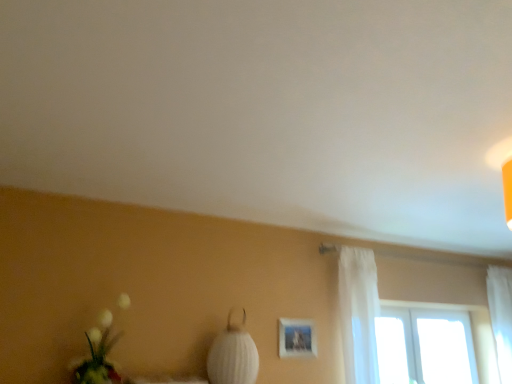
Question: From a real-world perspective, is white fabric lampshade at center on top of white sheer curtain at right, which is the second curtain from left to right?

Choices:
 (A) no
 (B) yes

Answer: (A)

Question: Is white fabric lampshade at center directly adjacent to white sheer curtain at right, the first curtain when ordered from right to left?

Choices:
 (A) yes
 (B) no

Answer: (B)

Question: Is white fabric lampshade at center turned away from white sheer curtain at right, which is the second curtain from left to right?

Choices:
 (A) no
 (B) yes

Answer: (A)

Question: From the image's perspective, is white fabric lampshade at center located above white sheer curtain at right, marked as the 1th curtain in a back-to-front arrangement?

Choices:
 (A) yes
 (B) no

Answer: (A)

Question: Is white fabric lampshade at center aimed at white sheer curtain at right, acting as the 2th curtain starting from the front?

Choices:
 (A) yes
 (B) no

Answer: (B)

Question: In terms of width, does white sheer curtain at right, arranged as the 1th curtain when viewed from the front, look wider or thinner when compared to white sheer curtain at right, which is the second curtain from left to right?

Choices:
 (A) thin
 (B) wide

Answer: (A)

Question: In the image, is white sheer curtain at right, the second curtain positioned from the back, positioned in front of or behind white sheer curtain at right, the first curtain when ordered from right to left?

Choices:
 (A) front
 (B) behind

Answer: (A)

Question: Based on their positions, is white sheer curtain at right, the second curtain positioned from the back, located to the left or right of white sheer curtain at right, which is the second curtain from left to right?

Choices:
 (A) right
 (B) left

Answer: (B)

Question: From the image's perspective, is white sheer curtain at right, marked as the first curtain in a left-to-right arrangement, positioned above or below white sheer curtain at right, marked as the 1th curtain in a back-to-front arrangement?

Choices:
 (A) above
 (B) below

Answer: (A)

Question: From their relative heights in the image, would you say transparent glass window at upper right is taller or shorter than white sheer curtain at right, marked as the 1th curtain in a back-to-front arrangement?

Choices:
 (A) tall
 (B) short

Answer: (B)

Question: Considering the positions of point (381, 362) and point (505, 329), is point (381, 362) closer or farther from the camera than point (505, 329)?

Choices:
 (A) farther
 (B) closer

Answer: (B)

Question: In the image, is transparent glass window at upper right positioned in front of or behind white sheer curtain at right, marked as the 1th curtain in a back-to-front arrangement?

Choices:
 (A) behind
 (B) front

Answer: (B)

Question: In terms of width, does transparent glass window at upper right look wider or thinner when compared to white sheer curtain at right, acting as the 2th curtain starting from the front?

Choices:
 (A) wide
 (B) thin

Answer: (B)

Question: Is point (290, 336) closer or farther from the camera than point (495, 340)?

Choices:
 (A) closer
 (B) farther

Answer: (A)

Question: From the image's perspective, is matte white picture frame at center positioned above or below white sheer curtain at right, which is the second curtain from left to right?

Choices:
 (A) above
 (B) below

Answer: (A)